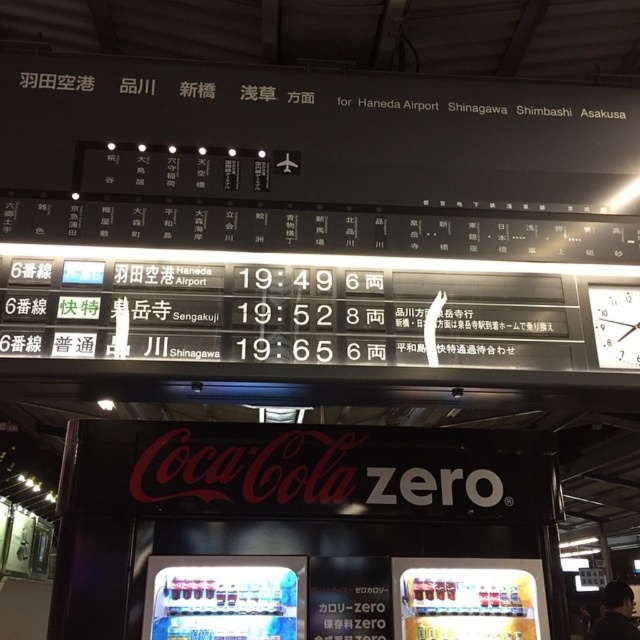
Question: Which object is closer to the camera taking this photo?

Choices:
 (A) metallic silver vending machine at center
 (B) metallic silver vending machine at lower right

Answer: (A)

Question: Can you confirm if black plastic coca-cola zero at center is positioned to the left of metallic silver vending machine at lower right?

Choices:
 (A) yes
 (B) no

Answer: (A)

Question: Which is nearer to the metallic silver vending machine at center?

Choices:
 (A) white plastic clock at upper right
 (B) white plastic scoreboard at upper center
 (C) metallic silver vending machine at lower right
 (D) black plastic coca-cola zero at center

Answer: (D)

Question: Which of the following is the farthest from the observer?

Choices:
 (A) white plastic scoreboard at upper center
 (B) black plastic coca-cola zero at center
 (C) metallic silver vending machine at center

Answer: (C)

Question: Can you confirm if white plastic scoreboard at upper center is positioned to the left of metallic silver vending machine at center?

Choices:
 (A) yes
 (B) no

Answer: (B)

Question: Does black plastic coca-cola zero at center appear under white plastic clock at upper right?

Choices:
 (A) yes
 (B) no

Answer: (A)